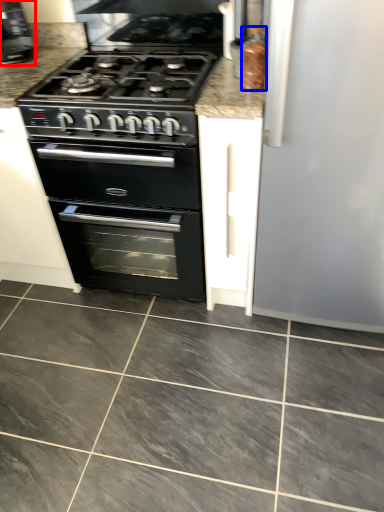
Question: Among these objects, which one is nearest to the camera, coffee machine (highlighted by a red box) or appliance (highlighted by a blue box)?

Choices:
 (A) coffee machine
 (B) appliance

Answer: (B)